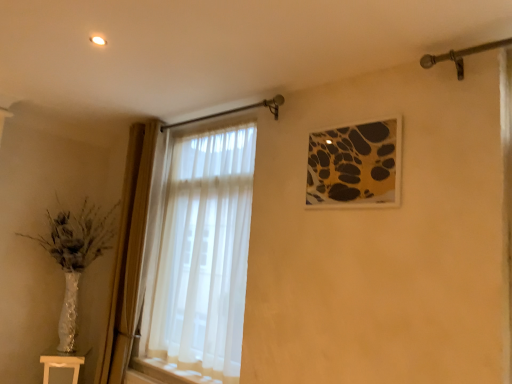
In order to click on gold-framed artwork at upper right in this screenshot , I will do `click(355, 166)`.

Measure the distance between gold-framed artwork at upper right and camera.

gold-framed artwork at upper right is 6.24 feet away from camera.

Describe the element at coordinates (355, 166) in the screenshot. This screenshot has height=384, width=512. I see `gold-framed artwork at upper right` at that location.

The height and width of the screenshot is (384, 512). I want to click on light wood table at lower left, so click(63, 361).

What is the approximate height of light wood table at lower left?

light wood table at lower left is 9.39 inches in height.

This screenshot has height=384, width=512. What do you see at coordinates (63, 361) in the screenshot?
I see `light wood table at lower left` at bounding box center [63, 361].

The width and height of the screenshot is (512, 384). In order to click on gold-framed artwork at upper right in this screenshot , I will do `click(355, 166)`.

Based on their positions, is light wood table at lower left located to the left or right of gold-framed artwork at upper right?

In the image, light wood table at lower left appears on the left side of gold-framed artwork at upper right.

Is the depth of light wood table at lower left less than that of gold-framed artwork at upper right?

No, light wood table at lower left is further to the viewer.

Does point (53, 356) come behind point (375, 142)?

Yes.

From the image's perspective, is light wood table at lower left above or below gold-framed artwork at upper right?

Clearly, from the image's perspective, light wood table at lower left is below gold-framed artwork at upper right.

From a real-world perspective, is light wood table at lower left located beneath gold-framed artwork at upper right?

Yes, from a real-world perspective, light wood table at lower left is under gold-framed artwork at upper right.

Looking at their sizes, would you say light wood table at lower left is wider or thinner than gold-framed artwork at upper right?

Clearly, light wood table at lower left has more width compared to gold-framed artwork at upper right.

From their relative heights in the image, would you say light wood table at lower left is taller or shorter than gold-framed artwork at upper right?

Considering their sizes, light wood table at lower left has less height than gold-framed artwork at upper right.

Can you confirm if light wood table at lower left is smaller than gold-framed artwork at upper right?

No.

Is gold-framed artwork at upper right inside light wood table at lower left?

Actually, gold-framed artwork at upper right is outside light wood table at lower left.

Is light wood table at lower left next to gold-framed artwork at upper right?

No, light wood table at lower left is not touching gold-framed artwork at upper right.

Is light wood table at lower left facing towards gold-framed artwork at upper right?

No, light wood table at lower left does not turn towards gold-framed artwork at upper right.

How different are the orientations of light wood table at lower left and gold-framed artwork at upper right in degrees?

53.7 degrees.

How far apart are light wood table at lower left and gold-framed artwork at upper right?

The distance of light wood table at lower left from gold-framed artwork at upper right is 2.30 meters.

The image size is (512, 384). Identify the location of table located underneath the gold-framed artwork at upper right (from a real-world perspective). (63, 361).

Which object is positioned more to the left, gold-framed artwork at upper right or light wood table at lower left?

light wood table at lower left is more to the left.

Which object is more forward, gold-framed artwork at upper right or light wood table at lower left?

gold-framed artwork at upper right.

Considering the positions of point (361, 170) and point (77, 376), is point (361, 170) closer or farther from the camera than point (77, 376)?

Clearly, point (361, 170) is closer to the camera than point (77, 376).

From the image's perspective, is gold-framed artwork at upper right under light wood table at lower left?

No.

From a real-world perspective, is gold-framed artwork at upper right under light wood table at lower left?

Actually, gold-framed artwork at upper right is physically above light wood table at lower left in the real world.

Looking at this image, considering the relative sizes of gold-framed artwork at upper right and light wood table at lower left in the image provided, is gold-framed artwork at upper right thinner than light wood table at lower left?

Yes.

In terms of height, does gold-framed artwork at upper right look taller or shorter compared to light wood table at lower left?

Clearly, gold-framed artwork at upper right is taller compared to light wood table at lower left.

Based on the photo, in terms of size, does gold-framed artwork at upper right appear bigger or smaller than light wood table at lower left?

gold-framed artwork at upper right is smaller than light wood table at lower left.

Would you say gold-framed artwork at upper right is outside light wood table at lower left?

gold-framed artwork at upper right is positioned outside light wood table at lower left.

Is gold-framed artwork at upper right next to light wood table at lower left and touching it?

There is a gap between gold-framed artwork at upper right and light wood table at lower left.

Does gold-framed artwork at upper right turn towards light wood table at lower left?

No, gold-framed artwork at upper right is not aimed at light wood table at lower left.

How much distance is there between gold-framed artwork at upper right and light wood table at lower left?

A distance of 7.55 feet exists between gold-framed artwork at upper right and light wood table at lower left.

Where is `table lying below the gold-framed artwork at upper right (from the image's perspective)`? table lying below the gold-framed artwork at upper right (from the image's perspective) is located at coordinates pos(63,361).

Identify the location of picture frame in front of the light wood table at lower left. The image size is (512, 384). click(x=355, y=166).

Where is `table below the gold-framed artwork at upper right (from the image's perspective)`? The height and width of the screenshot is (384, 512). table below the gold-framed artwork at upper right (from the image's perspective) is located at coordinates (63, 361).